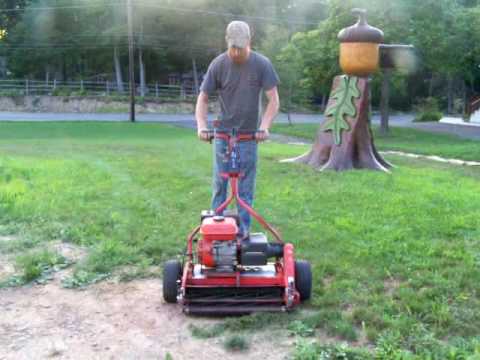
This screenshot has height=360, width=480. Identify the location of trunk of a fake tree. (344, 155).